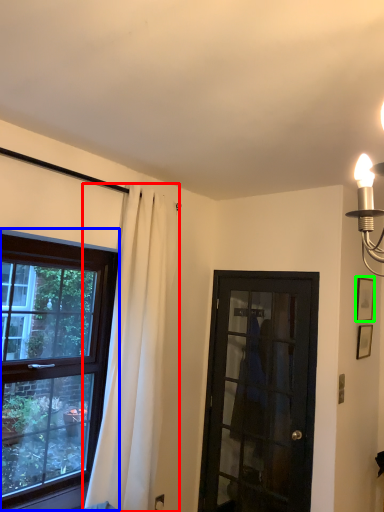
Question: Considering the real-world distances, which object is closest to curtain (highlighted by a red box)? window (highlighted by a blue box) or picture frame (highlighted by a green box).

Choices:
 (A) window
 (B) picture frame

Answer: (A)